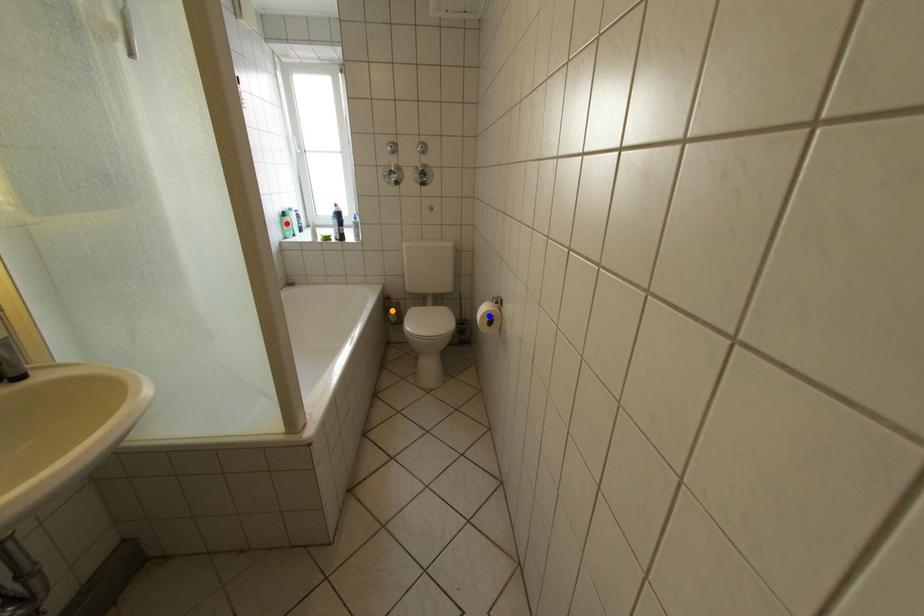
Order these from nearest to farthest:
orange point
blue point
red point

blue point → red point → orange point